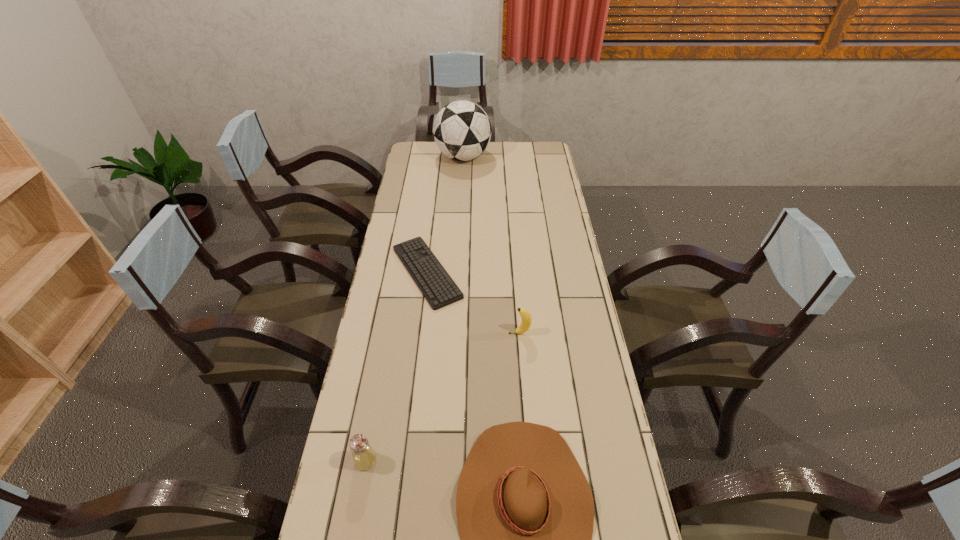
What are the coordinates of `the farthest object` in the screenshot? It's located at (462, 131).

At what (x,y) coordinates should I click in order to perform the action: click on soccer ball. Please return your answer as a coordinate pair (x, y). The height and width of the screenshot is (540, 960). Looking at the image, I should click on (462, 131).

Identify the location of banana. This screenshot has width=960, height=540. (526, 317).

Where is `saltshaker`? The width and height of the screenshot is (960, 540). saltshaker is located at coordinates (364, 457).

Find the location of a particular element. The image size is (960, 540). the shortest object is located at coordinates (434, 282).

The image size is (960, 540). I want to click on the second farthest object, so click(x=434, y=282).

Find the location of a particular element. This screenshot has height=540, width=960. vacant space located on the surface of the soccer ball where the brand logo is visible is located at coordinates (513, 157).

Find the location of a particular element. vacant area located from the stem of the banana is located at coordinates (454, 333).

Where is `vacant space located from the stem of the banana`? This screenshot has width=960, height=540. vacant space located from the stem of the banana is located at coordinates (468, 333).

At what (x,y) coordinates should I click in order to perform the action: click on free space located 0.310m from the stem of the banana. Please return your answer as a coordinate pair (x, y). This screenshot has height=540, width=960. Looking at the image, I should click on (414, 333).